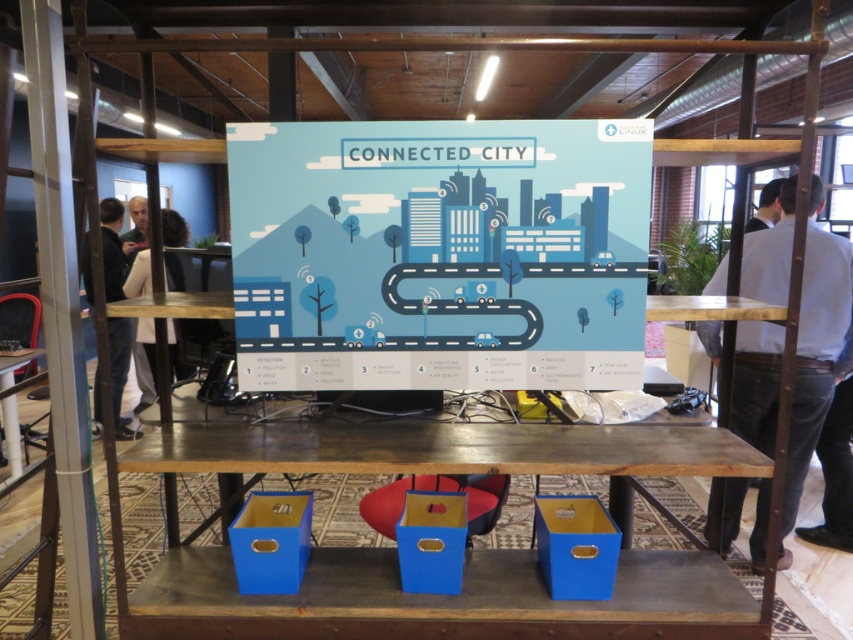
Question: Does blue cardboard box at center appear under dark gray sweater at left?

Choices:
 (A) yes
 (B) no

Answer: (A)

Question: Based on their relative distances, which object is nearer to the blue cardboard boxes at lower center?

Choices:
 (A) blue cardboard box at center
 (B) wooden table at center
 (C) matte blue cardboard box at lower right
 (D) dark gray sweater at left

Answer: (A)

Question: Considering the real-world distances, which object is farthest from the matte blue cardboard box at lower right?

Choices:
 (A) wooden table at center
 (B) dark brown leather jacket at left

Answer: (B)

Question: Is blue cardboard box at lower center above dark brown leather jacket at left?

Choices:
 (A) yes
 (B) no

Answer: (B)

Question: Is blue jeans at right below blue cardboard box at center?

Choices:
 (A) no
 (B) yes

Answer: (A)

Question: Which point is farther from the camera taking this photo?

Choices:
 (A) (320, 436)
 (B) (546, 573)
 (C) (430, 544)
 (D) (173, 376)

Answer: (D)